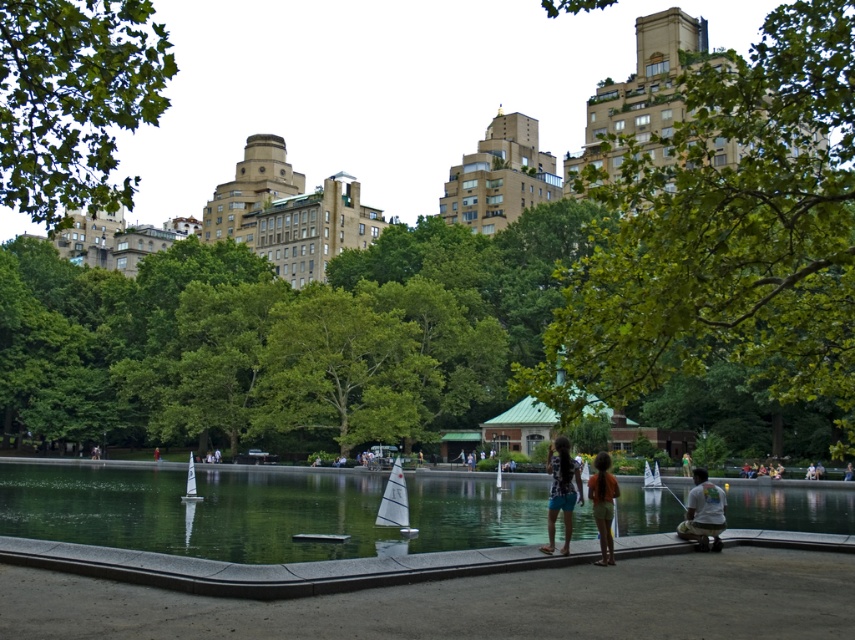
Is green leafy tree at center shorter than matte black dress at center?

No.

The width and height of the screenshot is (855, 640). Describe the element at coordinates (343, 371) in the screenshot. I see `green leafy tree at center` at that location.

Between point (388, 424) and point (552, 490), which one is positioned behind?

The point (388, 424) is more distant.

What are the coordinates of `green leafy tree at center` in the screenshot? It's located at (343, 371).

Is point (38, 182) behind point (573, 497)?

No, (38, 182) is closer to viewer.

Who is more forward, (48, 156) or (546, 547)?

Positioned in front is point (48, 156).

Where is `green leafy tree at upper left`? green leafy tree at upper left is located at coordinates (74, 100).

Is matte black dress at center further to camera compared to white cotton shirt at lower right?

No, it is not.

This screenshot has height=640, width=855. Identify the location of matte black dress at center. (561, 492).

Does point (550, 531) come farther from viewer compared to point (721, 493)?

No, it is in front of (721, 493).

At what (x,y) coordinates should I click in order to perform the action: click on matte black dress at center. Please return your answer as a coordinate pair (x, y). Looking at the image, I should click on tap(561, 492).